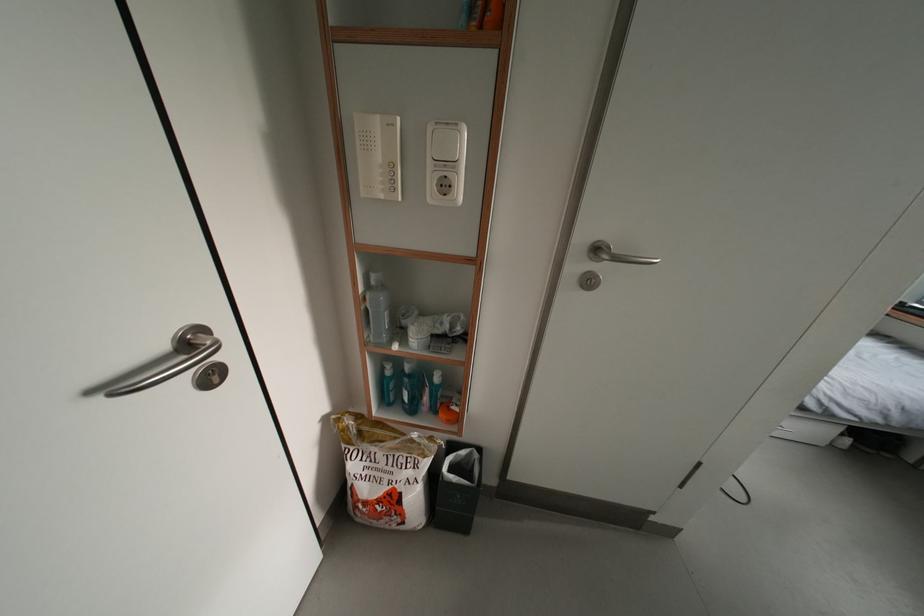
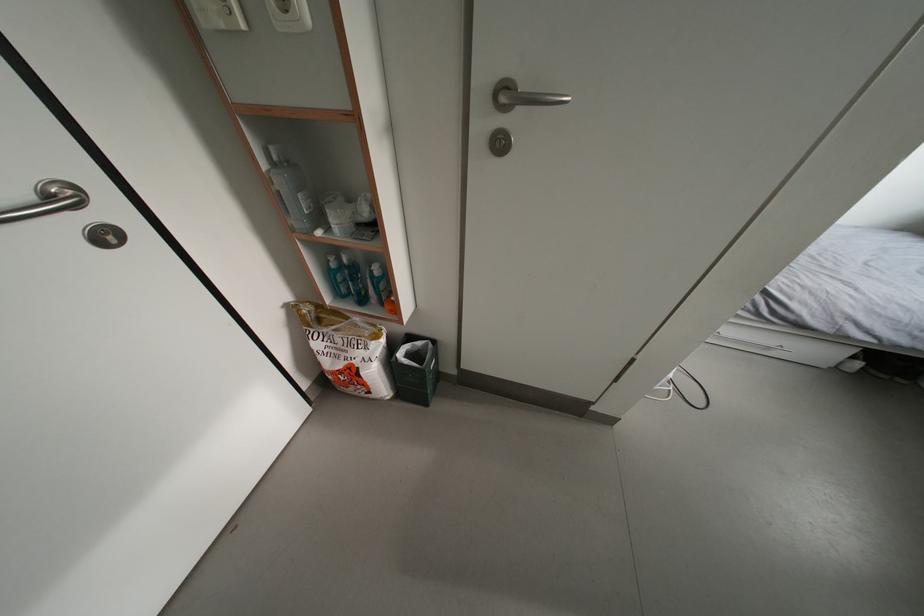
The point at (395, 378) is marked in the first image. Where is the corresponding point in the second image?

(339, 270)